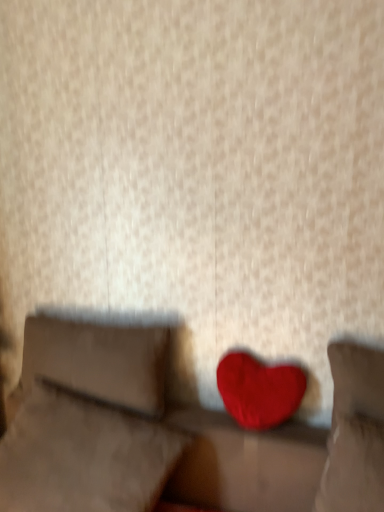
Question: Is velvet red heart at center closer to camera compared to velvet red heart at center, which ranks as the third pillow in left-to-right order?

Choices:
 (A) yes
 (B) no

Answer: (A)

Question: From a real-world perspective, is velvet red heart at center physically below velvet red heart at center, which ranks as the third pillow in left-to-right order?

Choices:
 (A) yes
 (B) no

Answer: (A)

Question: From the image's perspective, would you say velvet red heart at center is shown under velvet red heart at center, which ranks as the third pillow in left-to-right order?

Choices:
 (A) no
 (B) yes

Answer: (B)

Question: Is velvet red heart at center smaller than velvet red heart at center, which appears as the 1th pillow when viewed from the right?

Choices:
 (A) yes
 (B) no

Answer: (B)

Question: Does velvet red heart at center have a lesser width compared to velvet red heart at center, which appears as the 1th pillow when viewed from the right?

Choices:
 (A) no
 (B) yes

Answer: (A)

Question: Looking at their shapes, would you say velvet red heart at center, acting as the second pillow starting from the right, is wider or thinner than suede-like beige pillow at left, the 1th pillow when ordered from left to right?

Choices:
 (A) thin
 (B) wide

Answer: (B)

Question: From a real-world perspective, relative to suede-like beige pillow at left, the third pillow positioned from the right, is velvet red heart at center, arranged as the second pillow when viewed from the left, vertically above or below?

Choices:
 (A) below
 (B) above

Answer: (A)

Question: From the image's perspective, relative to suede-like beige pillow at left, the third pillow positioned from the right, is velvet red heart at center, acting as the second pillow starting from the right, above or below?

Choices:
 (A) above
 (B) below

Answer: (B)

Question: Considering the positions of velvet red heart at center, arranged as the second pillow when viewed from the left, and suede-like beige pillow at left, the 1th pillow when ordered from left to right, in the image, is velvet red heart at center, arranged as the second pillow when viewed from the left, bigger or smaller than suede-like beige pillow at left, the 1th pillow when ordered from left to right,?

Choices:
 (A) small
 (B) big

Answer: (B)

Question: Considering their positions, is matte red heart at center located in front of or behind suede-like beige pillow at left, the 1th pillow when ordered from left to right?

Choices:
 (A) front
 (B) behind

Answer: (A)

Question: From a real-world perspective, relative to suede-like beige pillow at left, the third pillow positioned from the right, is matte red heart at center vertically above or below?

Choices:
 (A) above
 (B) below

Answer: (B)

Question: In terms of size, does matte red heart at center appear bigger or smaller than suede-like beige pillow at left, the third pillow positioned from the right?

Choices:
 (A) small
 (B) big

Answer: (A)

Question: In terms of width, does matte red heart at center look wider or thinner when compared to suede-like beige pillow at left, the 1th pillow when ordered from left to right?

Choices:
 (A) thin
 (B) wide

Answer: (A)

Question: Is matte red heart at center to the left or to the right of velvet red heart at center, which ranks as the third pillow in left-to-right order, in the image?

Choices:
 (A) left
 (B) right

Answer: (A)

Question: Is matte red heart at center inside the boundaries of velvet red heart at center, which appears as the 1th pillow when viewed from the right, or outside?

Choices:
 (A) outside
 (B) inside

Answer: (A)